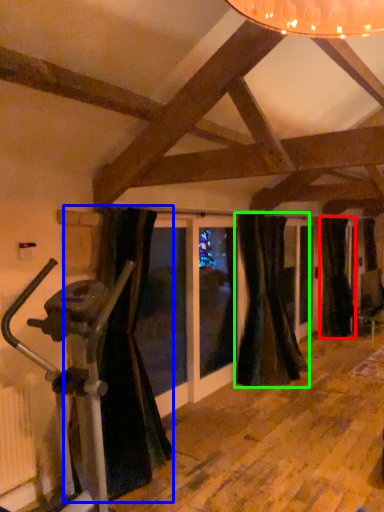
Question: Which is farther away from curtain (highlighted by a red box)? curtain (highlighted by a blue box) or curtain (highlighted by a green box)?

Choices:
 (A) curtain
 (B) curtain

Answer: (A)